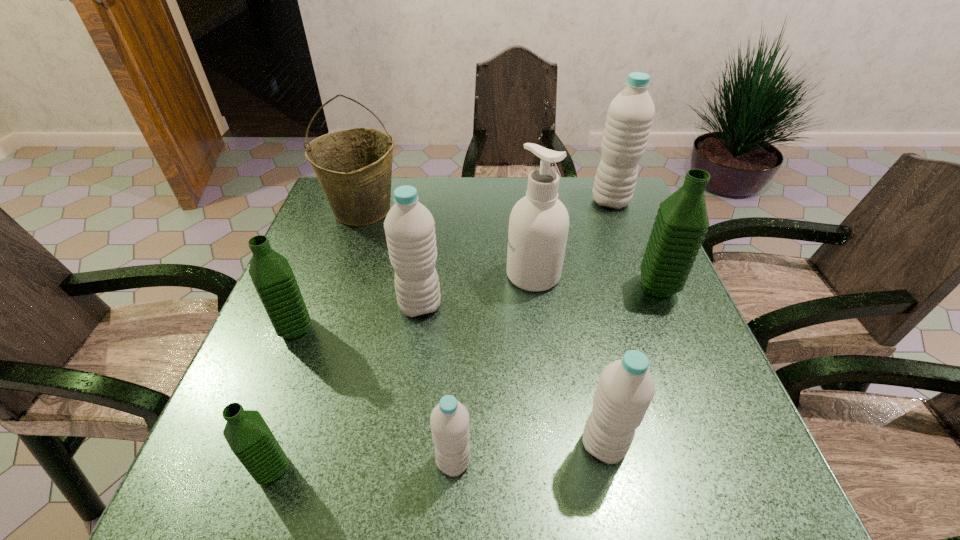
The image size is (960, 540). Find the location of `vacant area that lies between the farthest white water bottle and the second biggest green water bottle`. vacant area that lies between the farthest white water bottle and the second biggest green water bottle is located at coordinates (453, 265).

This screenshot has width=960, height=540. I want to click on free space between the smallest white water bottle and the wine bucket, so click(408, 336).

At what (x,y) coordinates should I click in order to perform the action: click on vacant point located between the second biggest green water bottle and the fourth water bottle from left to right. Please return your answer as a coordinate pair (x, y). The width and height of the screenshot is (960, 540). Looking at the image, I should click on (374, 395).

The height and width of the screenshot is (540, 960). Identify the location of blank region between the farthest white water bottle and the smallest green water bottle. (442, 335).

Select which object is the eighth closest to the wine bucket. Please provide its 2D coordinates. Your answer should be formatted as a tuple, i.e. [(x, y)], where the tuple contains the x and y coordinates of a point satisfying the conditions above.

[(626, 388)]

Where is `object that is the fourth closest one to the leftmost white water bottle`? This screenshot has height=540, width=960. object that is the fourth closest one to the leftmost white water bottle is located at coordinates (449, 420).

The width and height of the screenshot is (960, 540). I want to click on water bottle that stands as the sixth closest to the fifth object from left to right, so click(x=630, y=114).

Select which water bottle appears as the seventh closest to the cleansing agent. Please provide its 2D coordinates. Your answer should be formatted as a tuple, i.e. [(x, y)], where the tuple contains the x and y coordinates of a point satisfying the conditions above.

[(249, 437)]

Locate which white water bottle is the third closest to the fifth water bottle from right to left. Please provide its 2D coordinates. Your answer should be formatted as a tuple, i.e. [(x, y)], where the tuple contains the x and y coordinates of a point satisfying the conditions above.

[(630, 114)]

The width and height of the screenshot is (960, 540). I want to click on white water bottle that is the closest one to the smallest green water bottle, so click(x=449, y=420).